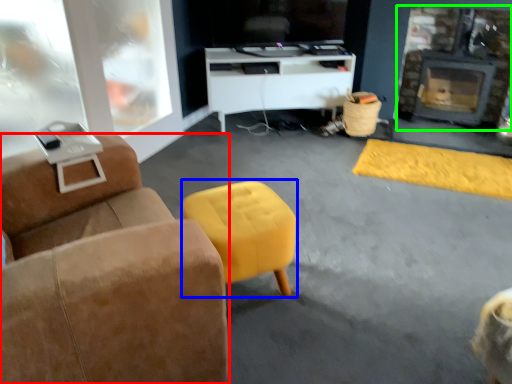
Question: Which is nearer to the furniture (highlighted by a red box)? stool (highlighted by a blue box) or fireplace (highlighted by a green box).

Choices:
 (A) stool
 (B) fireplace

Answer: (A)